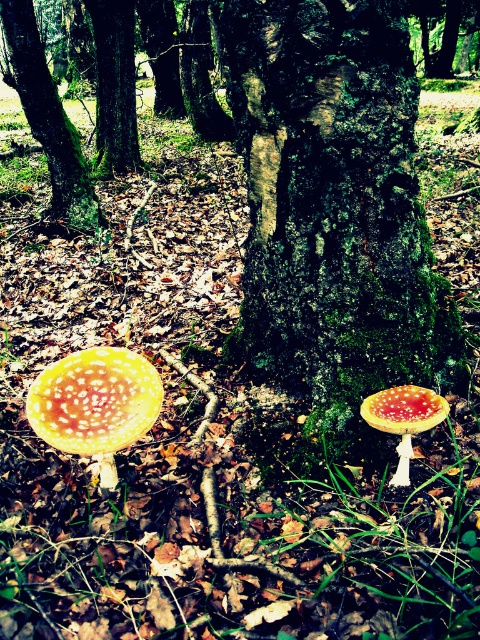
Question: Does yellow spotted mushroom at lower left appear on the right side of yellow spotted mushroom at lower center?

Choices:
 (A) yes
 (B) no

Answer: (B)

Question: Which point is farther to the camera?

Choices:
 (A) green mossy tree at center
 (B) yellow spotted mushroom at lower center
 (C) yellow spotted mushroom at lower left

Answer: (A)

Question: Does yellow spotted mushroom at lower left lie in front of green mossy tree at center?

Choices:
 (A) no
 (B) yes

Answer: (B)

Question: Can you confirm if yellow spotted mushroom at lower left is positioned below green mossy tree at center?

Choices:
 (A) yes
 (B) no

Answer: (A)

Question: Which object appears closest to the camera in this image?

Choices:
 (A) yellow spotted mushroom at lower center
 (B) green mossy tree at center
 (C) yellow spotted mushroom at lower left

Answer: (A)

Question: Which object is the closest to the yellow spotted mushroom at lower left?

Choices:
 (A) yellow spotted mushroom at lower center
 (B) green mossy tree at center

Answer: (A)